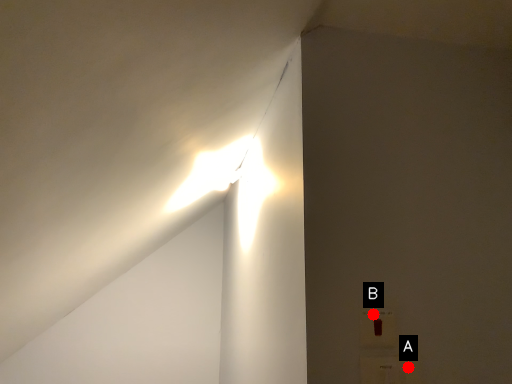
Question: Two points are circled on the image, labeled by A and B beside each circle. Which of the following is the closest to the observer?

Choices:
 (A) A is closer
 (B) B is closer

Answer: (A)